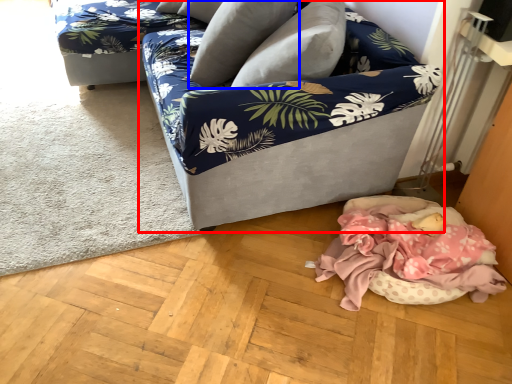
Question: Which object is further to the camera taking this photo, studio couch (highlighted by a red box) or pillow (highlighted by a blue box)?

Choices:
 (A) studio couch
 (B) pillow

Answer: (B)